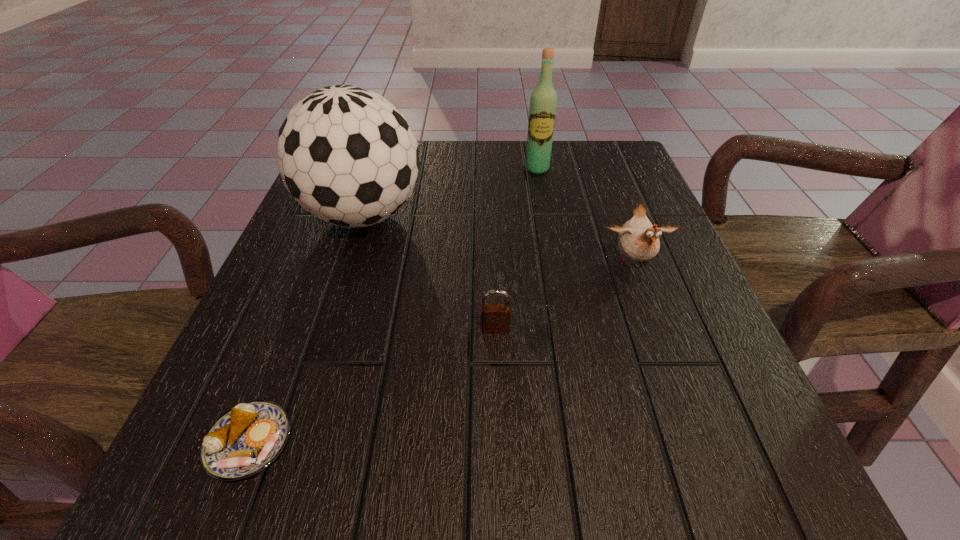
Identify the location of vacant space located 0.390m on the front of the soccer ball. (290, 444).

The height and width of the screenshot is (540, 960). Find the location of `blank area located 0.330m at the beak of the rightmost object`. blank area located 0.330m at the beak of the rightmost object is located at coordinates (705, 456).

Where is `free spot located 0.110m on the front-facing side of the second shortest object`? The image size is (960, 540). free spot located 0.110m on the front-facing side of the second shortest object is located at coordinates (497, 392).

You are a GUI agent. You are given a task and a screenshot of the screen. Output one action in this format:
    pyautogui.click(x=<x>, y=<y>)
    Task: Click on the blank area located on the back of the pastry
    
    Given the screenshot: What is the action you would take?
    pyautogui.click(x=295, y=326)

The image size is (960, 540). Identify the location of wine bottle at the far edge. (543, 103).

Find the location of `soccer ball that is at the far edge`. soccer ball that is at the far edge is located at coordinates (347, 155).

Locate an element on the screen. The height and width of the screenshot is (540, 960). object that is positioned at the near edge is located at coordinates (245, 440).

This screenshot has height=540, width=960. Identify the location of soccer ball that is at the left edge. (347, 155).

Locate an element on the screen. Image resolution: width=960 pixels, height=540 pixels. pastry situated at the left edge is located at coordinates (245, 440).

Identify the location of object at the right edge. The width and height of the screenshot is (960, 540). (638, 239).